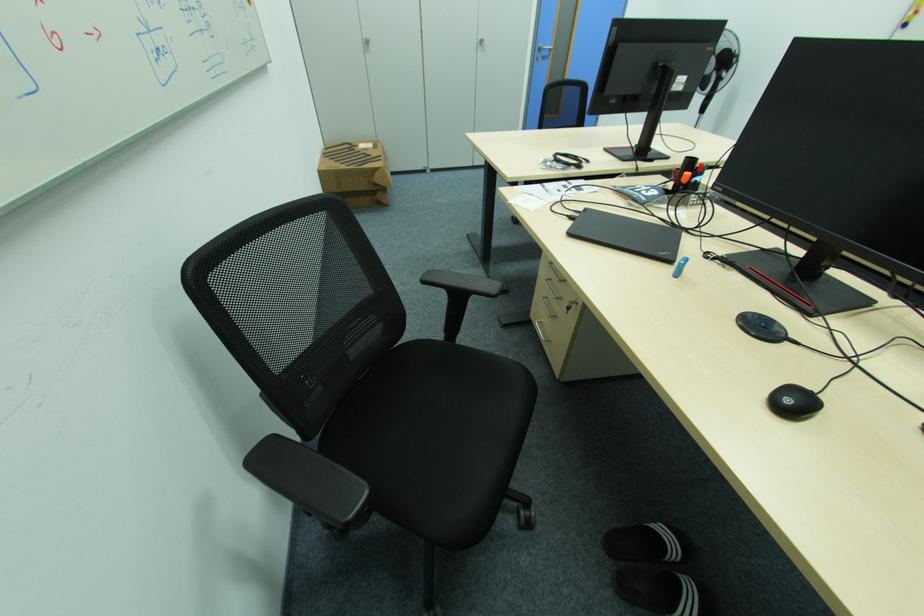
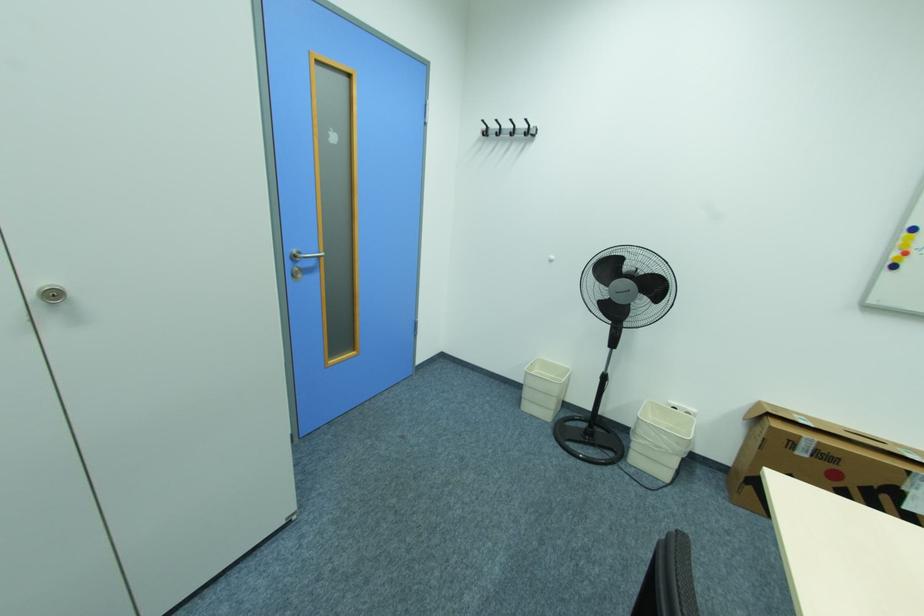
In the second image, find the point that corresponds to point 545,47 in the first image.

(300, 252)